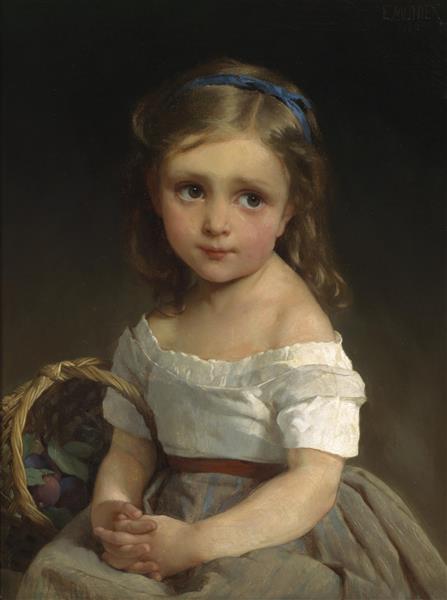
Where is `painting`? The image size is (447, 600). painting is located at coordinates (346, 323).